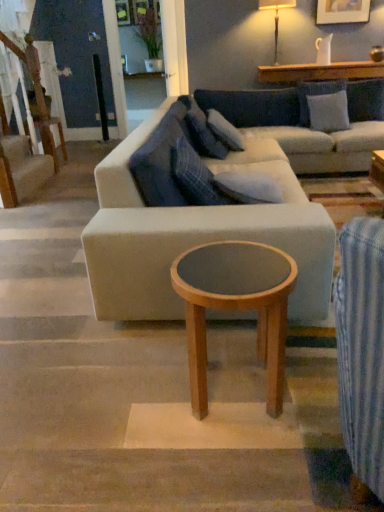
Question: From a real-world perspective, is gray fabric pillow at center, which ranks as the third pillow in front-to-back order, positioned above or below light gray fabric couch at center?

Choices:
 (A) above
 (B) below

Answer: (A)

Question: From the image's perspective, is gray fabric pillow at center, arranged as the 2th pillow when viewed from the back, above or below light gray fabric couch at center?

Choices:
 (A) below
 (B) above

Answer: (A)

Question: Which is nearer to the wooden staircase at left?

Choices:
 (A) gray fabric pillow at center, arranged as the 2th pillow when viewed from the back
 (B) blue plaid pillow at center, which appears as the third pillow when viewed from the back
 (C) wooden round table at left
 (D) white fabric pillow at upper right, which ranks as the 4th pillow in left-to-right order
 (E) blue plaid pillow at center, the first pillow from the front

Answer: (C)

Question: Based on their relative distances, which object is farther from the light brown wood coffee table at center?

Choices:
 (A) blue plaid pillow at center, which is counted as the 3th pillow, starting from the right
 (B) white fabric lampshade at upper right
 (C) blue plaid pillow at center, which is the 1th pillow in left-to-right order
 (D) white fabric pillow at upper right, which ranks as the 4th pillow in left-to-right order
 (E) wooden staircase at left

Answer: (B)